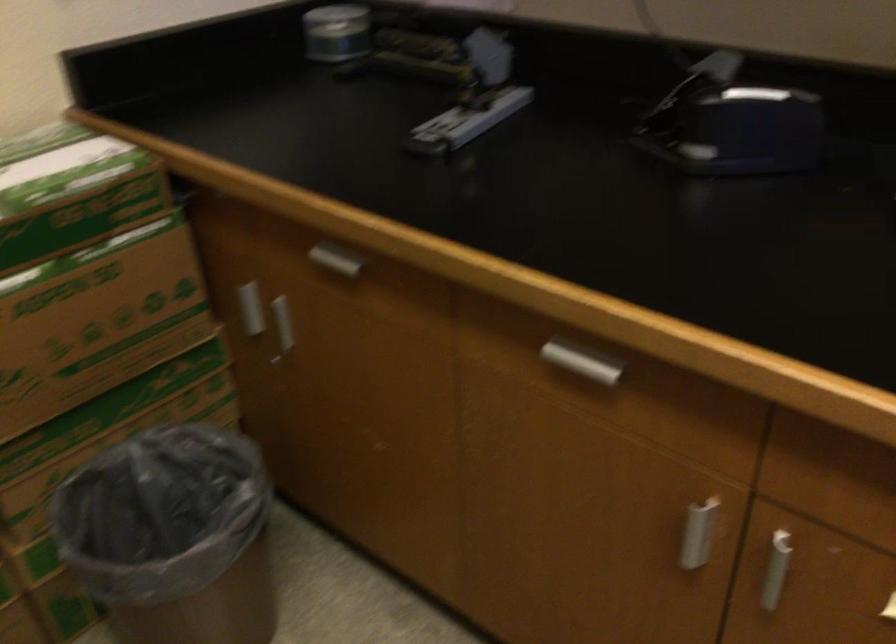
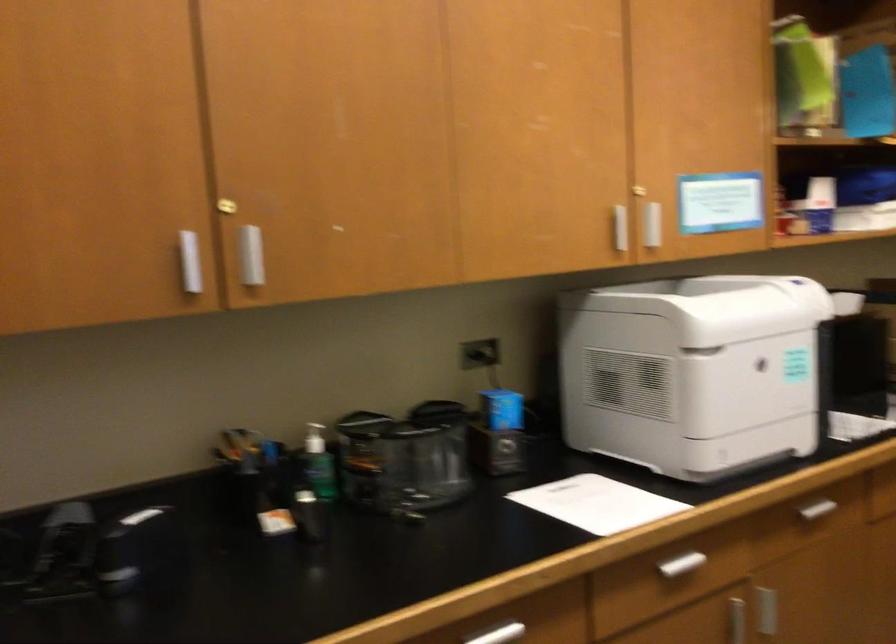
Question: The camera is either moving clockwise (left) or counter-clockwise (right) around the object. The first image is from the beginning of the video and the second image is from the end. Is the camera moving left or right when shooting the video?

Choices:
 (A) Left
 (B) Right

Answer: (A)